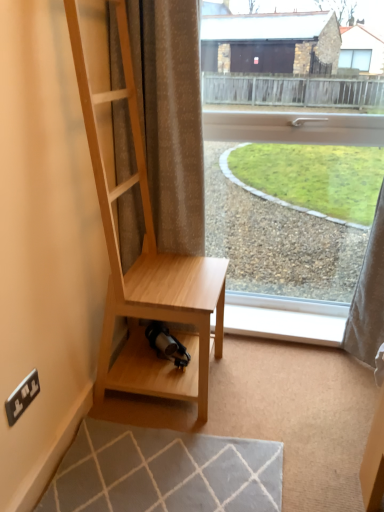
This screenshot has height=512, width=384. In order to click on blank space above white plastic window sill at lower center (from a real-world perspective) in this screenshot , I will do `click(284, 322)`.